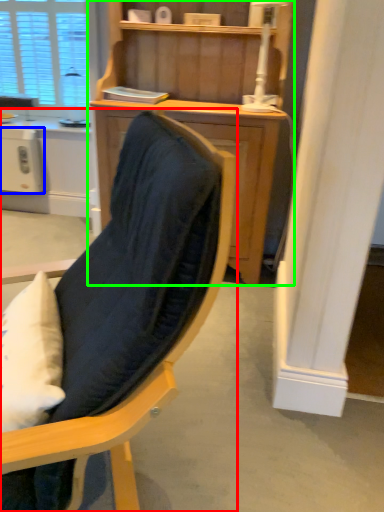
Question: Based on their relative distances, which object is nearer to chair (highlighted by a red box)? Choose from appliance (highlighted by a blue box) and cupboard (highlighted by a green box).

Choices:
 (A) appliance
 (B) cupboard

Answer: (B)